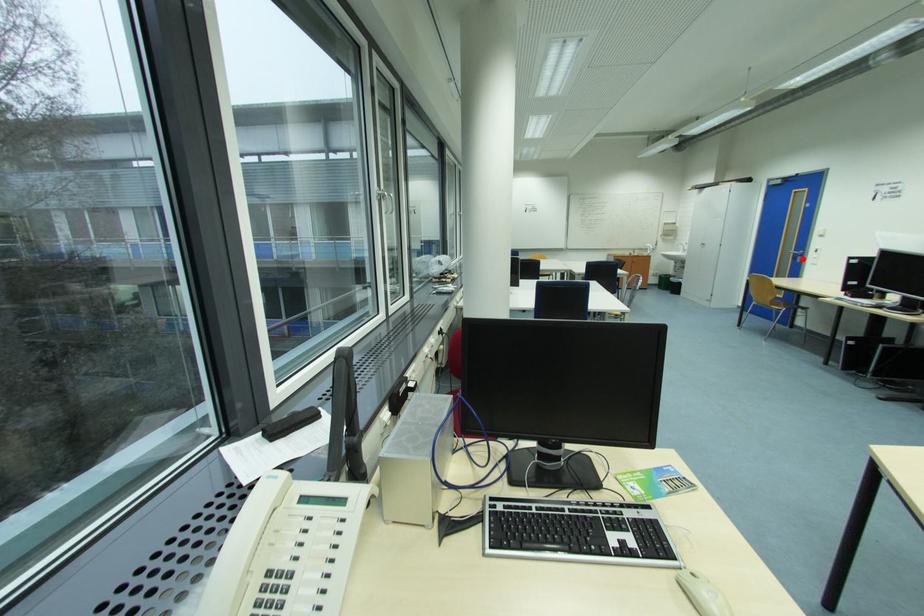
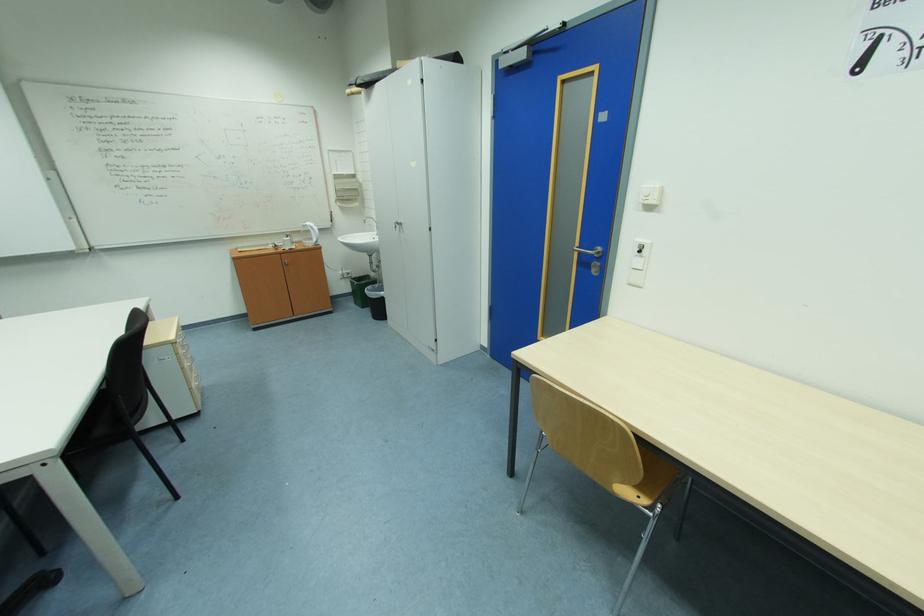
In the second image, find the point that corresponds to the highlighted location in the first image.

(590, 264)